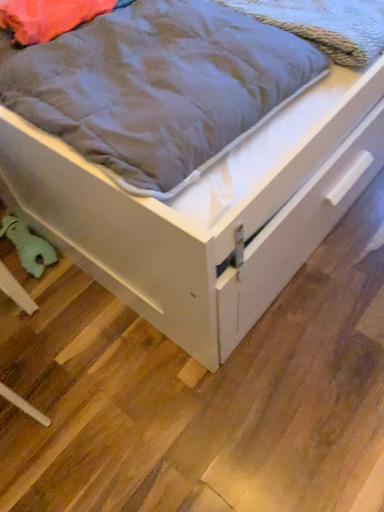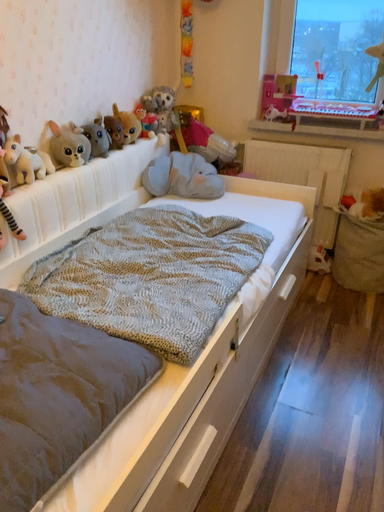
Question: Which way did the camera rotate in the video?

Choices:
 (A) rotated upward
 (B) rotated downward

Answer: (A)